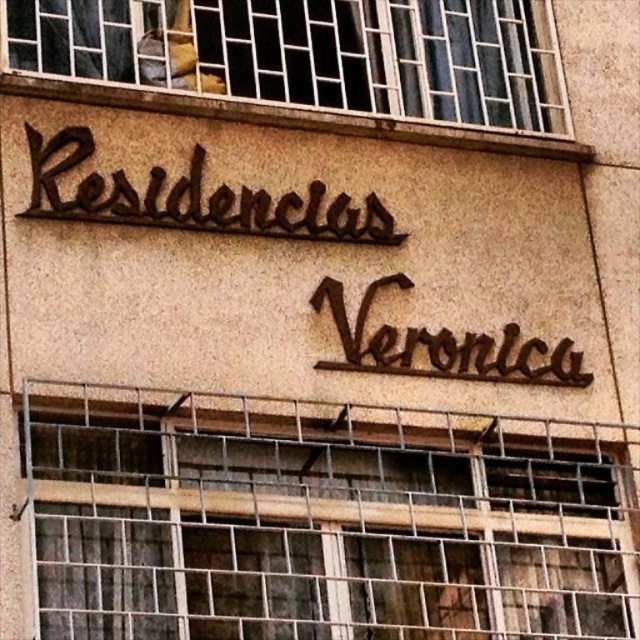
Is metallic bars at upper center closer to the viewer compared to dark brown metal sign at center?

Yes, metallic bars at upper center is closer to the viewer.

Who is positioned more to the left, metallic bars at upper center or dark brown metal sign at center?

From the viewer's perspective, metallic bars at upper center appears more on the left side.

Who is more distant from viewer, (381, 83) or (547, 346)?

The point (381, 83) is behind.

What are the coordinates of `metallic bars at upper center` in the screenshot? It's located at (307, 65).

Who is more distant from viewer, (547,61) or (106,193)?

The point (547,61) is more distant.

Is metallic bars at upper center smaller than brown metallic sign at upper center?

Actually, metallic bars at upper center might be larger than brown metallic sign at upper center.

Where is `metallic bars at upper center`? metallic bars at upper center is located at coordinates (307, 65).

Is metallic grid at center positioned at the back of dark brown metal sign at center?

That is False.

Measure the distance between metallic grid at center and camera.

metallic grid at center and camera are 36.11 meters apart from each other.

Where is `metallic grid at center`? This screenshot has width=640, height=640. metallic grid at center is located at coordinates (332, 516).